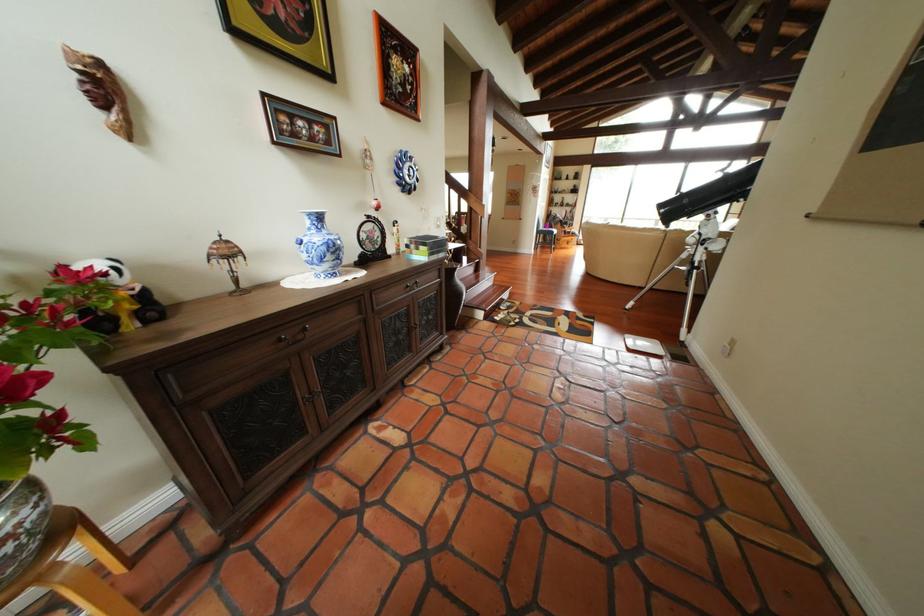
What do you see at coordinates (426, 246) in the screenshot?
I see `the stack of books` at bounding box center [426, 246].